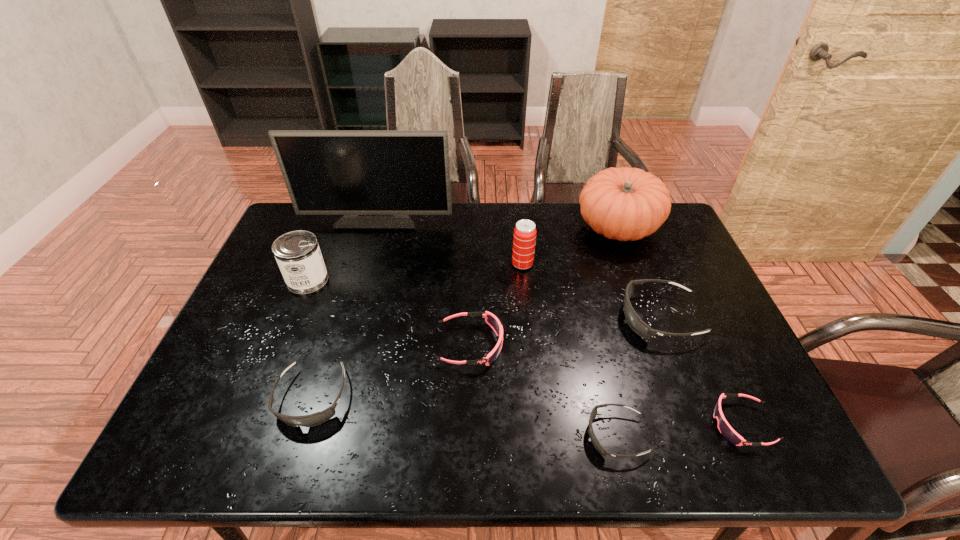
At what (x,y) coordinates should I click in order to perform the action: click on monitor located at the far edge. Please return your answer as a coordinate pair (x, y). Looking at the image, I should click on (376, 178).

Find the location of a particular element. This screenshot has width=960, height=540. pumpkin positioned at the far edge is located at coordinates (626, 204).

Identify the location of monitor that is positioned at the left edge. pyautogui.click(x=376, y=178).

Locate an element on the screen. can positioned at the left edge is located at coordinates (298, 255).

What are the coordinates of `pumpkin that is at the right edge` in the screenshot? It's located at (626, 204).

Locate an element on the screen. object present at the far left corner is located at coordinates (376, 178).

Locate an element on the screen. The width and height of the screenshot is (960, 540). object that is at the far right corner is located at coordinates (626, 204).

Locate an element on the screen. This screenshot has width=960, height=540. object that is at the near right corner is located at coordinates (726, 430).

The width and height of the screenshot is (960, 540). I want to click on vacant area at the far edge, so click(353, 243).

What are the coordinates of `free spot at the right edge of the desktop` in the screenshot? It's located at (698, 354).